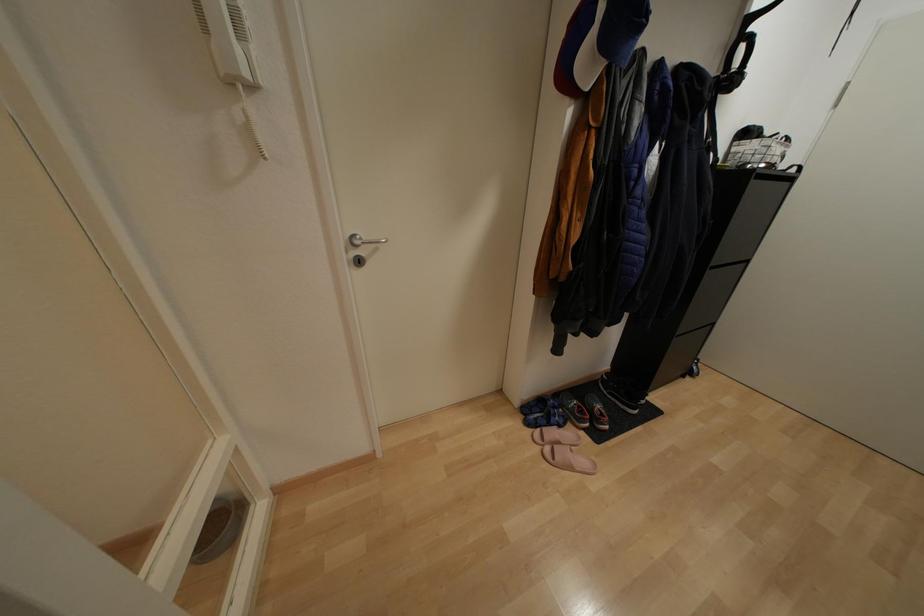
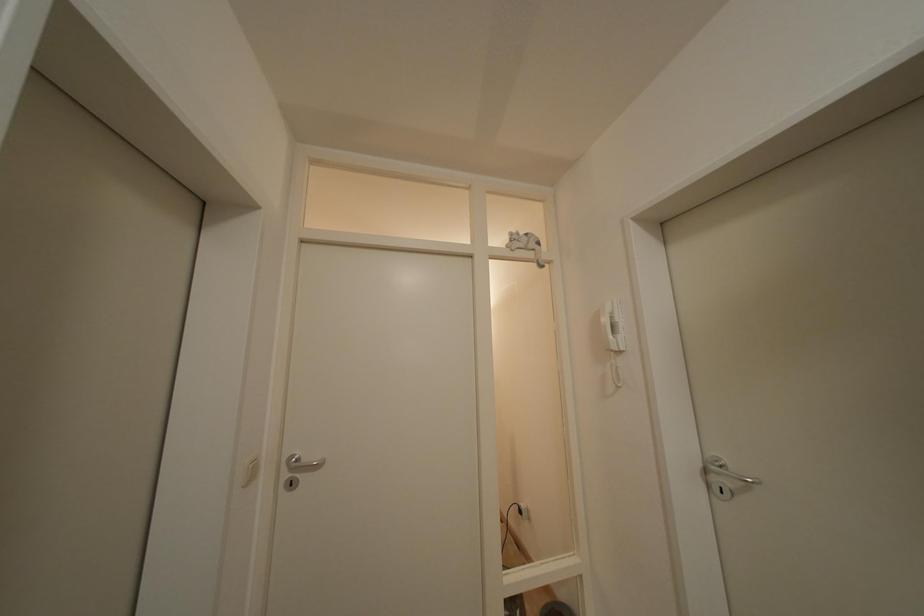
Question: The camera is either moving clockwise (left) or counter-clockwise (right) around the object. The first image is from the beginning of the video and the second image is from the end. Is the camera moving left or right when shooting the video?

Choices:
 (A) Left
 (B) Right

Answer: (B)